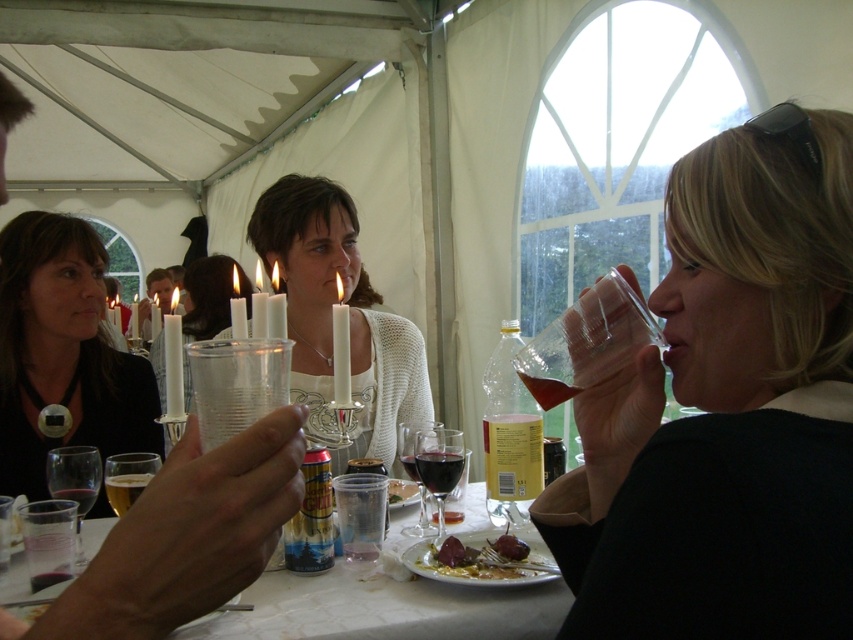
Is matte black dress at left below shiny dark red berry at plate center?

No, matte black dress at left is not below shiny dark red berry at plate center.

Locate an element on the screen. The height and width of the screenshot is (640, 853). matte black dress at left is located at coordinates (62, 353).

Which is behind, point (82, 481) or point (506, 541)?

The point (82, 481) is more distant.

Looking at this image, can you confirm if transparent plastic wine glass at lower left is positioned below shiny dark red berry at plate center?

Actually, transparent plastic wine glass at lower left is above shiny dark red berry at plate center.

What do you see at coordinates (74, 483) in the screenshot? I see `transparent plastic wine glass at lower left` at bounding box center [74, 483].

At what (x,y) coordinates should I click in order to perform the action: click on transparent plastic wine glass at lower left. Please return your answer as a coordinate pair (x, y). The width and height of the screenshot is (853, 640). Looking at the image, I should click on (74, 483).

Does translucent glass wine glass at lower center lie in front of translucent plastic glass at upper right?

No, translucent glass wine glass at lower center is further to the viewer.

From the picture: Is translucent glass wine glass at lower center thinner than translucent plastic glass at upper right?

Incorrect, translucent glass wine glass at lower center's width is not less than translucent plastic glass at upper right's.

Is point (445, 433) positioned after point (570, 396)?

That is True.

Image resolution: width=853 pixels, height=640 pixels. I want to click on translucent glass wine glass at lower center, so click(x=439, y=467).